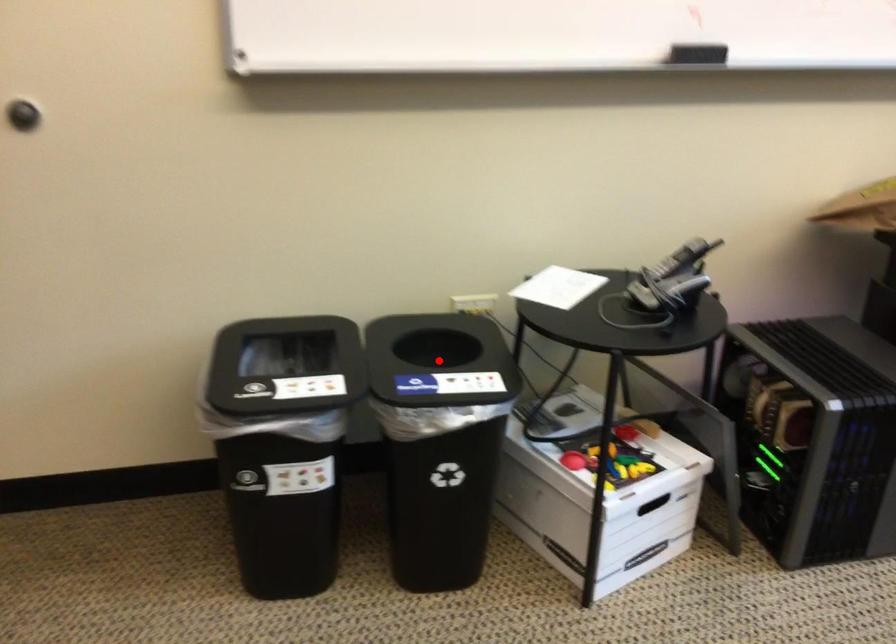
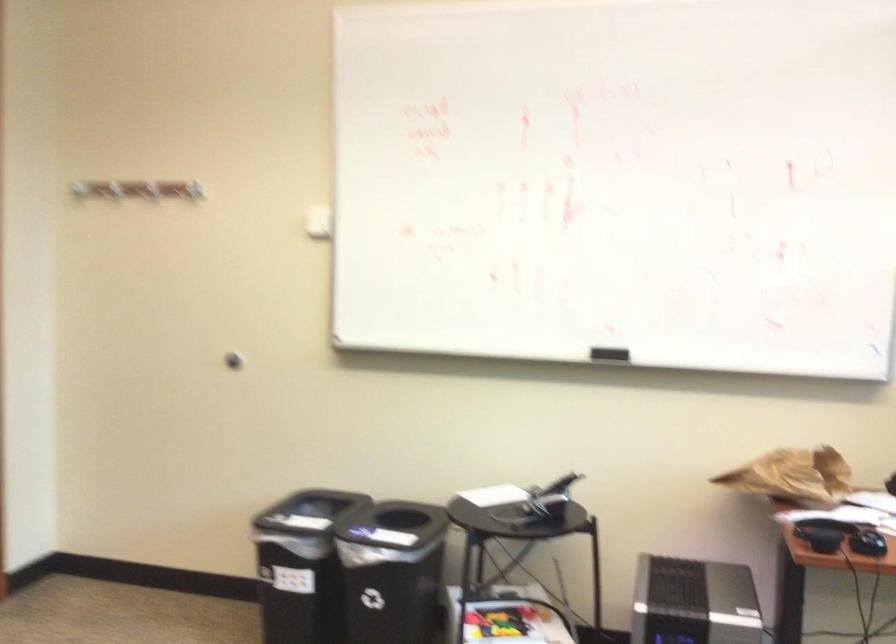
In the second image, find the point that corresponds to the highlighted location in the first image.

(426, 541)